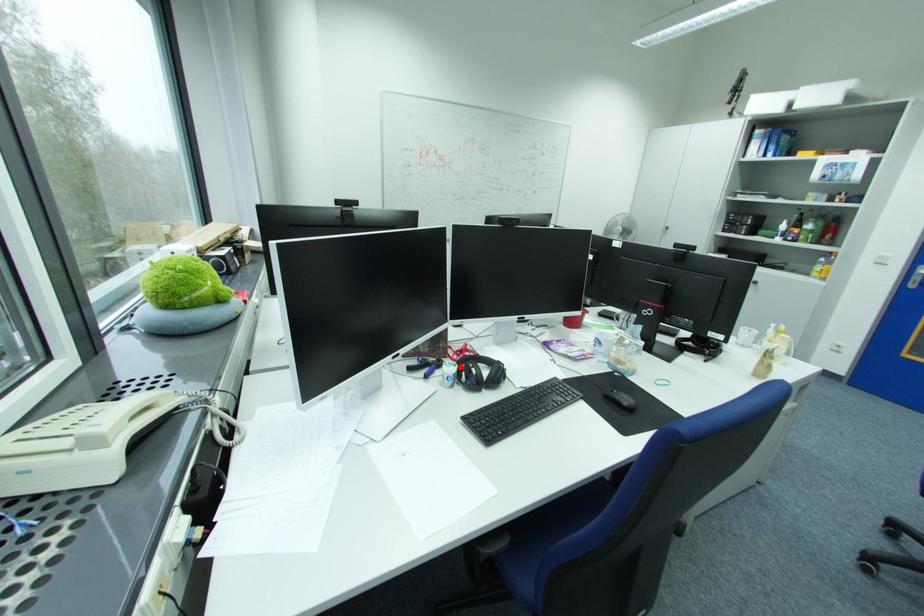
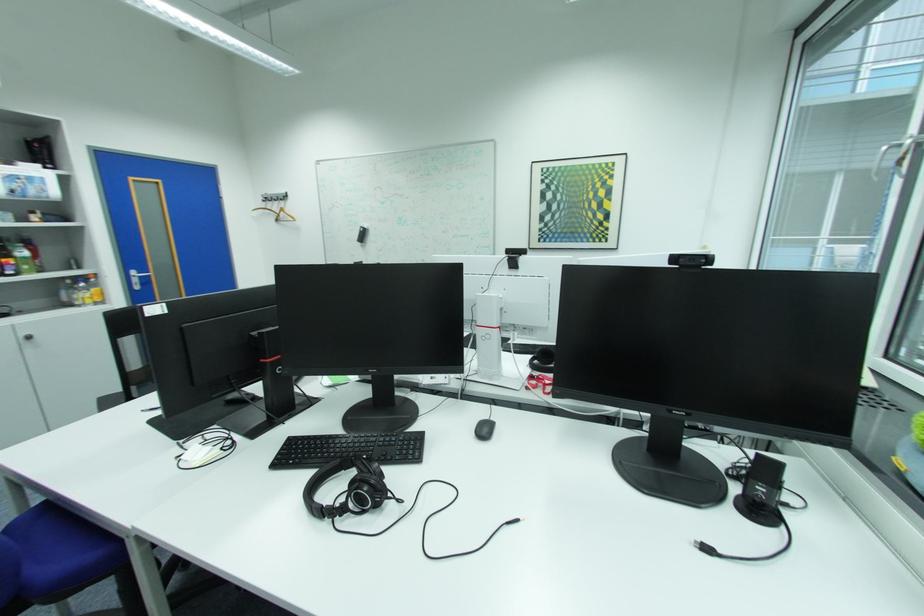
Question: I am providing you with two images of the same scene from different viewpoints. A red point is marked on the first image. Is the red point's position out of view in image 2?

Choices:
 (A) Yes
 (B) No

Answer: (A)